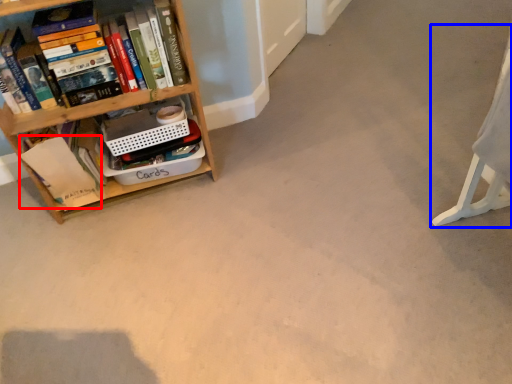
Question: Which object is further to the camera taking this photo, paperback book (highlighted by a red box) or swivel chair (highlighted by a blue box)?

Choices:
 (A) paperback book
 (B) swivel chair

Answer: (A)